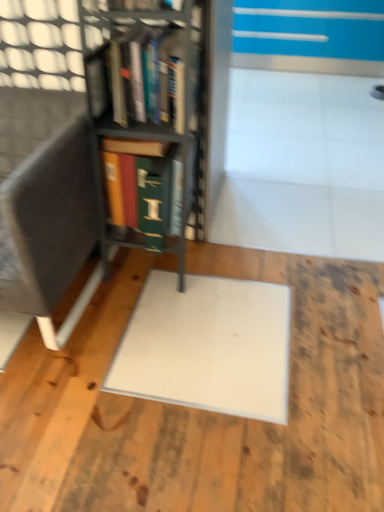
Question: Is point 226,467 closer or farther from the camera than point 165,73?

Choices:
 (A) farther
 (B) closer

Answer: (B)

Question: From the image's perspective, is white matte wood at center located above or below hardcover books at center, the second book from the bottom?

Choices:
 (A) above
 (B) below

Answer: (B)

Question: Which is nearer to the dark gray fabric armchair at left?

Choices:
 (A) white matte wood at center
 (B) metallic gray bookcase at center
 (C) hardcover books at center, the second book from the bottom
 (D) green matte book at center, the second book viewed from the top

Answer: (D)

Question: Which object is positioned closest to the white matte wood at center?

Choices:
 (A) hardcover books at center, the second book from the bottom
 (B) metallic gray bookcase at center
 (C) dark gray fabric armchair at left
 (D) green matte book at center, positioned as the first book in bottom-to-top order

Answer: (C)